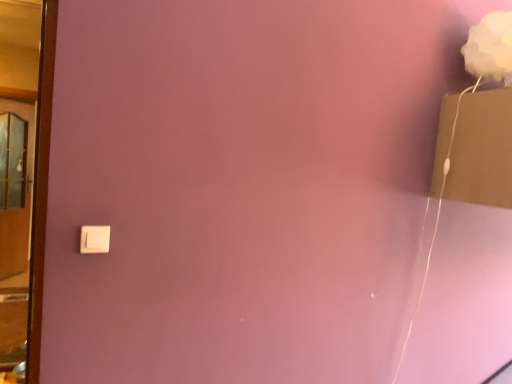
Question: Considering the relative sizes of white matte flower at upper right and wooden door at left in the image provided, is white matte flower at upper right bigger than wooden door at left?

Choices:
 (A) yes
 (B) no

Answer: (A)

Question: Can you see white matte flower at upper right touching wooden door at left?

Choices:
 (A) yes
 (B) no

Answer: (B)

Question: From the image's perspective, would you say white matte flower at upper right is positioned over wooden door at left?

Choices:
 (A) yes
 (B) no

Answer: (A)

Question: Does white matte flower at upper right come behind wooden door at left?

Choices:
 (A) yes
 (B) no

Answer: (A)

Question: Can you confirm if white matte flower at upper right is positioned to the right of wooden door at left?

Choices:
 (A) no
 (B) yes

Answer: (B)

Question: Is white matte flower at upper right aimed at wooden door at left?

Choices:
 (A) yes
 (B) no

Answer: (B)

Question: Is white matte flower at upper right at the back of wooden door at left?

Choices:
 (A) yes
 (B) no

Answer: (B)

Question: Can you confirm if wooden door at left is taller than white matte flower at upper right?

Choices:
 (A) yes
 (B) no

Answer: (A)

Question: Is wooden door at left in front of white matte flower at upper right?

Choices:
 (A) yes
 (B) no

Answer: (A)

Question: From a real-world perspective, does wooden door at left stand above white matte flower at upper right?

Choices:
 (A) yes
 (B) no

Answer: (B)

Question: From a real-world perspective, is wooden door at left below white matte flower at upper right?

Choices:
 (A) no
 (B) yes

Answer: (B)

Question: Is wooden door at left positioned beyond the bounds of white matte flower at upper right?

Choices:
 (A) yes
 (B) no

Answer: (A)

Question: From the image's perspective, is white plastic light switch at lower left over wooden door at left?

Choices:
 (A) yes
 (B) no

Answer: (B)